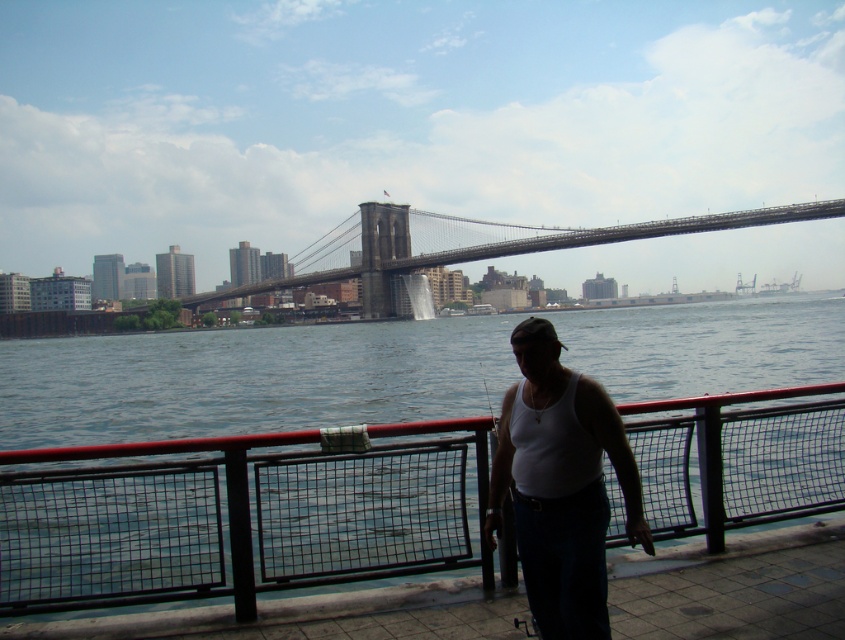
You are standing at the edge of the East River on the Brooklyn Bridge and want to cast a fishing line into the water. You have a fishing rod that requires 3 meters of space to swing comfortably. The black metal fence at lower center and the white cotton tank top at center are 2.79 meters apart. Is there enough space between them to safely swing your fishing rod without hitting either object?

The distance between the black metal fence at lower center and the white cotton tank top at center is 2.79 meters, which is less than the 3 meters required for safely swinging the fishing rod. Therefore, there isn not enough space to swing the rod comfortably without risking contact with either object.

You are standing at the edge of the East River looking at the scene. There is a black metal fence at lower center and a white cotton tank top at center. Which object is closer to you?

The black metal fence at lower center is positioned under the white cotton tank top at center, so the black metal fence at lower center is closer to you.